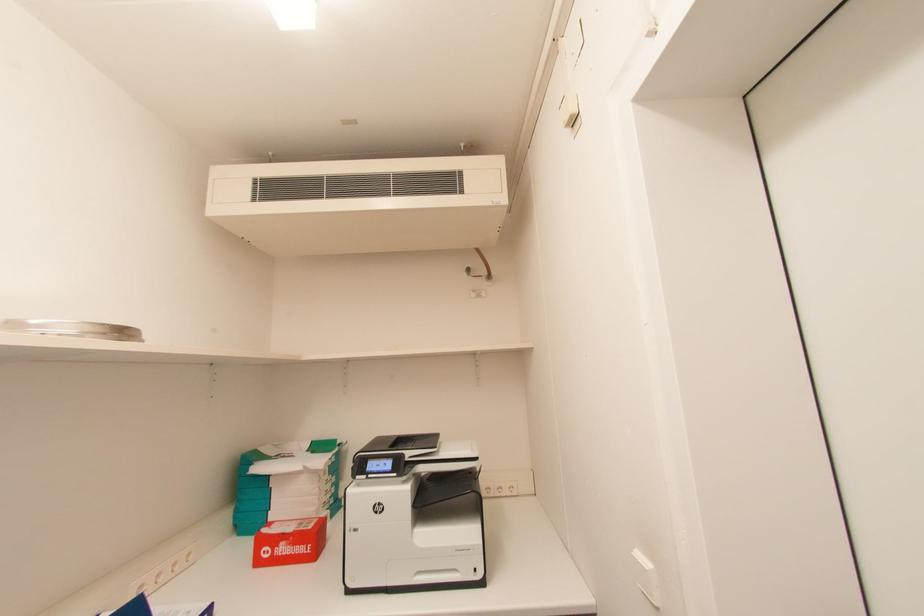
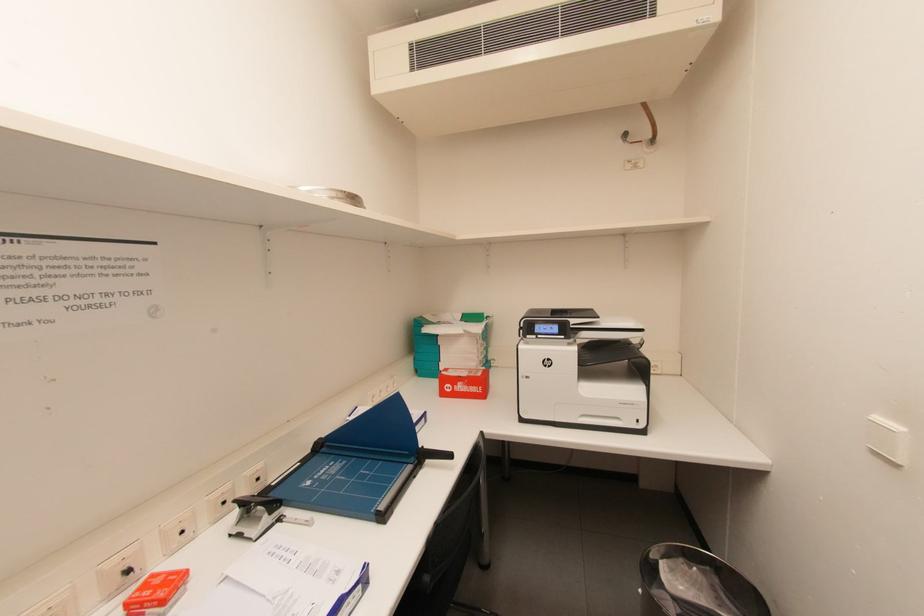
How did the camera likely rotate?

The rotation direction of the camera is left-down.